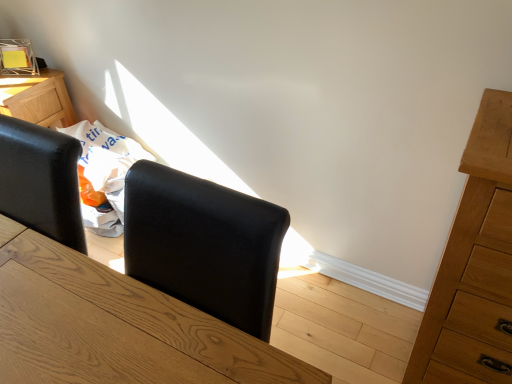
You are a GUI agent. You are given a task and a screenshot of the screen. Output one action in this format:
    pyautogui.click(x=<x>, y=<y>)
    Task: Click on the empty space that is ontop of black leather armchair at center (from a real-world perspective)
    The width and height of the screenshot is (512, 384).
    Given the screenshot: What is the action you would take?
    pyautogui.click(x=197, y=191)